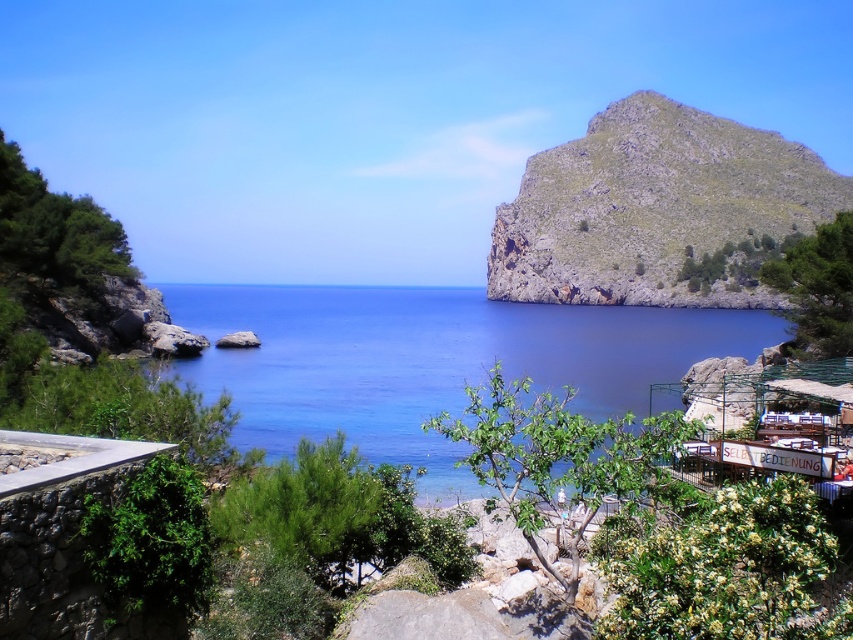
From the picture: Can you confirm if blue water at center is taller than green rocky hillside at upper right?

No.

Which is behind, point (483, 320) or point (548, 268)?

Point (548, 268)

Locate an element on the screen. blue water at center is located at coordinates (430, 362).